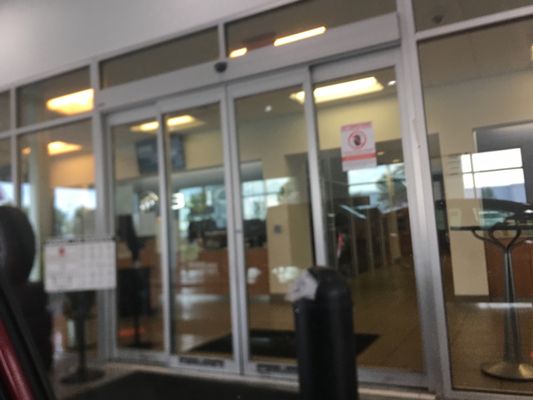
Image resolution: width=533 pixels, height=400 pixels. In order to click on ceiling in this screenshot , I will do `click(492, 53)`.